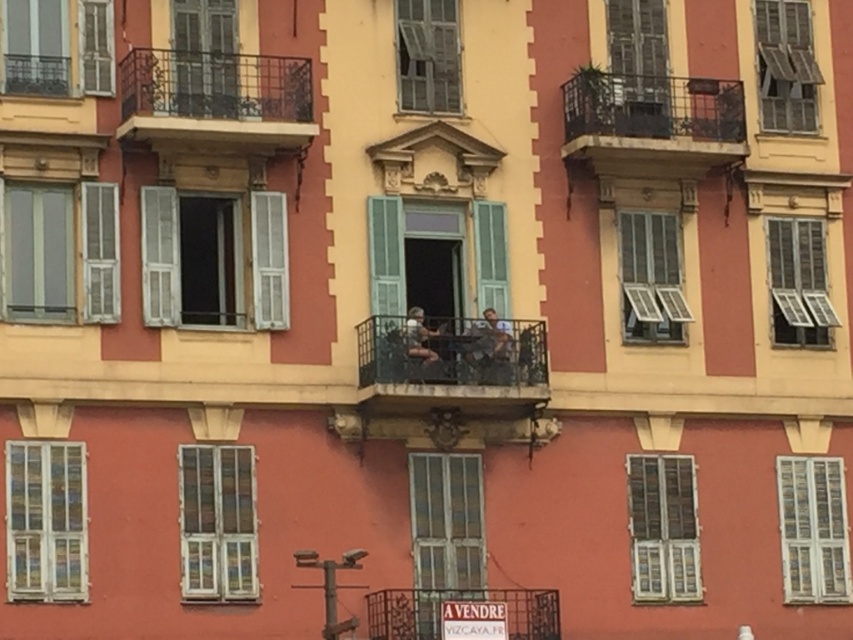
Find the location of a particular element. Image resolution: width=853 pixels, height=640 pixels. rustic metal balcony at upper right is located at coordinates (653, 124).

Can you confirm if rustic metal balcony at upper right is thinner than metallic black balcony at center?

Correct, rustic metal balcony at upper right's width is less than metallic black balcony at center's.

Is point (619, 86) more distant than point (408, 627)?

Yes, point (619, 86) is behind point (408, 627).

In order to click on rustic metal balcony at upper right in this screenshot , I will do (653, 124).

Can you confirm if rustic metal balcony at upper right is positioned to the right of wooden shutters at upper left?

Yes, rustic metal balcony at upper right is to the right of wooden shutters at upper left.

Does rustic metal balcony at upper right have a greater width compared to wooden shutters at upper left?

In fact, rustic metal balcony at upper right might be narrower than wooden shutters at upper left.

Who is more forward, (x=663, y=104) or (x=207, y=38)?

Positioned in front is point (x=207, y=38).

Image resolution: width=853 pixels, height=640 pixels. Find the location of `rustic metal balcony at upper right`. rustic metal balcony at upper right is located at coordinates (653, 124).

Who is positioned more to the right, rusty metal balcony at upper left or matte gray shirt at center?

From the viewer's perspective, matte gray shirt at center appears more on the right side.

Which is behind, point (123, 61) or point (480, 371)?

Point (480, 371)

Where is `rusty metal balcony at upper left`? Image resolution: width=853 pixels, height=640 pixels. rusty metal balcony at upper left is located at coordinates point(215,100).